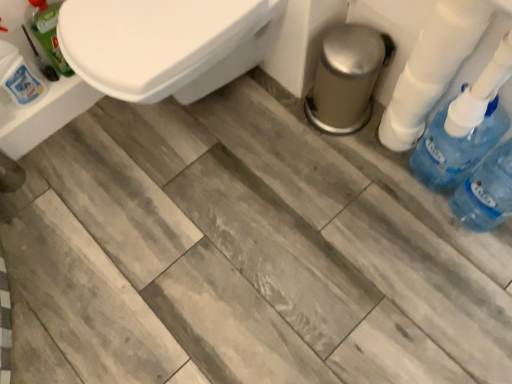
Question: Is blue translucent bottle at right bigger or smaller than white plastic toilet paper at right?

Choices:
 (A) small
 (B) big

Answer: (B)

Question: From the image's perspective, is blue translucent bottle at right positioned above or below white plastic toilet paper at right?

Choices:
 (A) above
 (B) below

Answer: (B)

Question: Based on their relative distances, which object is nearer to the translucent green bottle at upper left, the 2th cleaning product positioned from the left?

Choices:
 (A) translucent plastic bottle at upper left, the first cleaning product in the left-to-right sequence
 (B) blue translucent bottle at right
 (C) white plastic toilet paper at right
 (D) blue plastic bottle at right, arranged as the 1th cleaning product when viewed from the right

Answer: (A)

Question: Estimate the real-world distances between objects in this image. Which object is closer to the translucent plastic bottle at upper left, the first cleaning product in the left-to-right sequence?

Choices:
 (A) blue plastic bottle at right, arranged as the 1th cleaning product when viewed from the right
 (B) blue translucent bottle at right
 (C) white plastic toilet paper at right
 (D) translucent green bottle at upper left, the 2th cleaning product positioned from the left

Answer: (D)